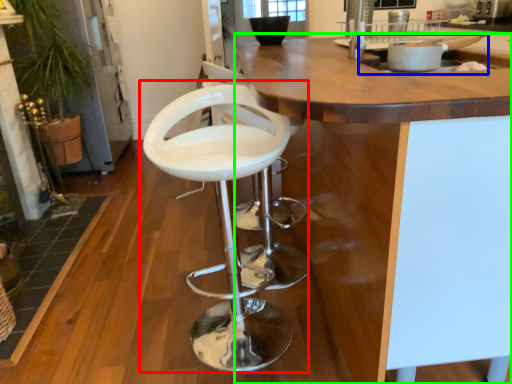
Question: Considering the real-world distances, which object is farthest from chair (highlighted by a red box)? sink (highlighted by a blue box) or countertop (highlighted by a green box)?

Choices:
 (A) sink
 (B) countertop

Answer: (A)